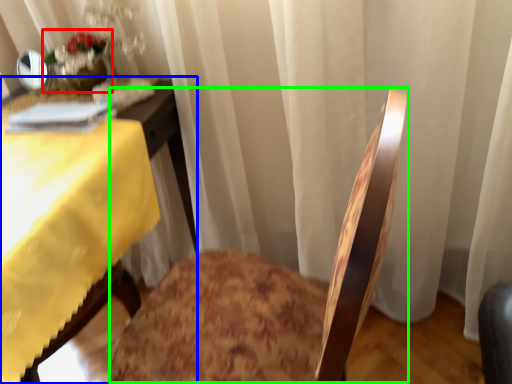
Question: Which object is positioned closest to floral arrangement (highlighted by a red box)? Select from table (highlighted by a blue box) and rocking chair (highlighted by a green box).

Choices:
 (A) table
 (B) rocking chair

Answer: (A)